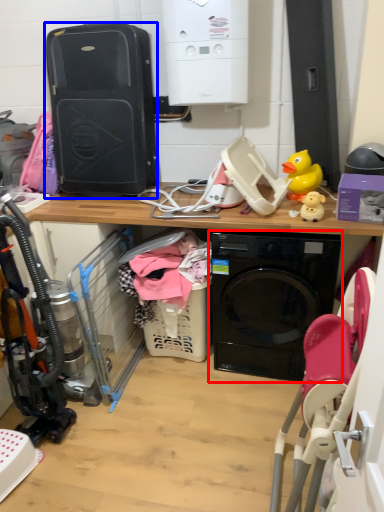
Question: Which of the following is the closest to the observer, washing machine (highlighted by a red box) or computer tower (highlighted by a blue box)?

Choices:
 (A) washing machine
 (B) computer tower

Answer: (A)